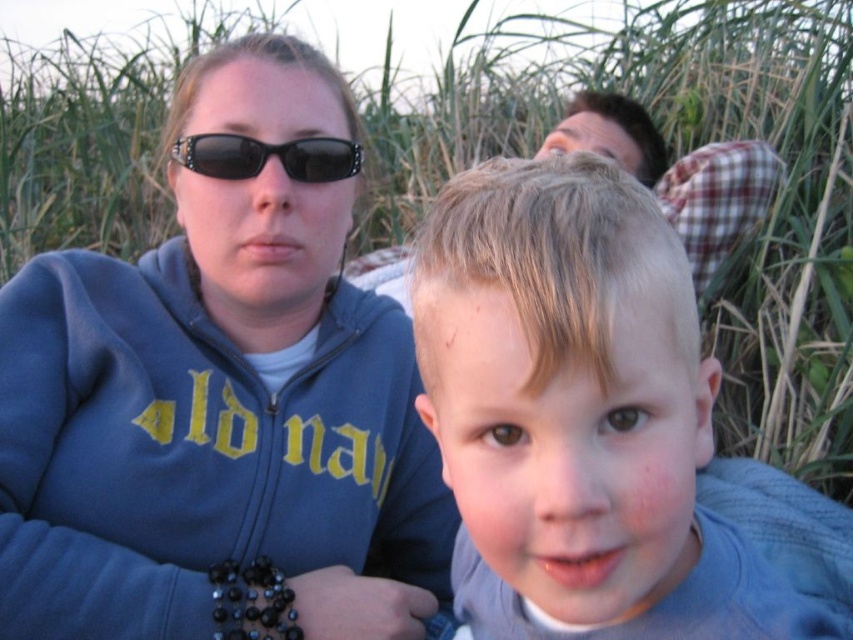
You are a photographer adjusting your camera settings to capture the scene. You notice the blue fleece jacket at upper left and the black plastic sunglasses at upper center. Which object is positioned higher in the frame?

The blue fleece jacket at upper left is taller than the black plastic sunglasses at upper center, so it is positioned higher in the frame.

Based on the scene description, is the light brown hair at center located above or below the black plastic sunglasses at upper center?

The light brown hair at center is below the black plastic sunglasses at upper center.

You are a photographer trying to capture a candid shot of the scene. You notice the light brown hair at center and the black plastic sunglasses at upper center. Which object is positioned to the right of the other?

The light brown hair at center is positioned to the right of the black plastic sunglasses at upper center.